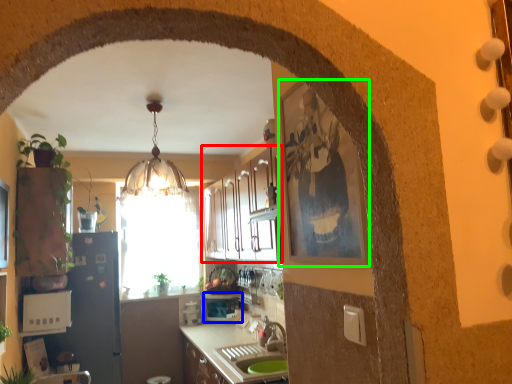
Question: Which object is positioned closest to cabinetry (highlighted by a red box)? Select from appliance (highlighted by a blue box) and picture frame (highlighted by a green box).

Choices:
 (A) appliance
 (B) picture frame

Answer: (A)